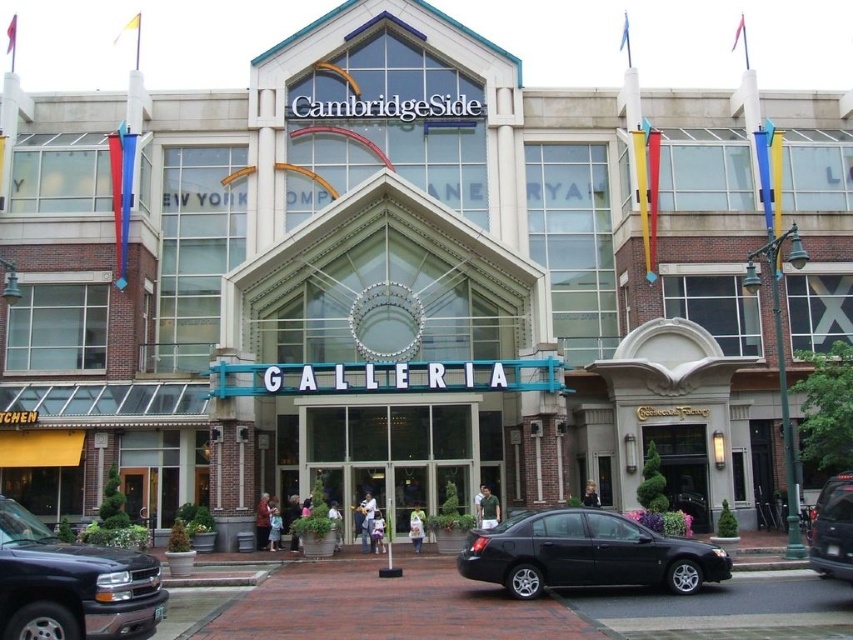
You are a visitor approaching the CambridgeSide Galleria from the front entrance. You see the matte black truck at lower left and the black wooden door at center. Which object is positioned higher in the image?

The matte black truck at lower left is above the black wooden door at center, so it is positioned higher in the image.

You are a delivery driver who needs to park your vehicle in the parking lot near the CambridgeSide Galleria. Your vehicle is wider than the average car. You see a black matte sedan at center and a matte black truck at lower left in the parking area. Which vehicle has a wider body to help you estimate your parking space?

The black matte sedan at center has a wider body than the matte black truck at lower left, so you can use its width as a reference to determine if your vehicle will fit in the parking space.

You are a delivery driver arriving at the CambridgeSide Galleria. You have a matte black truck at lower left and need to park it near the black wooden door at center. Considering the size of the parking space available, can your truck fit there?

The matte black truck at lower left is bigger than the black wooden door at center, so it might not fit in the parking space near the black wooden door at center if the space is sized for smaller vehicles.